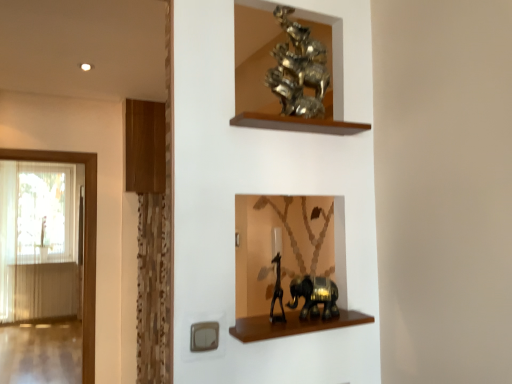
Question: Is wooden at left, the second shelf positioned from the front, wider or thinner than gold metallic sculpture at upper center, placed as the third animal when sorted from bottom to top?

Choices:
 (A) wide
 (B) thin

Answer: (A)

Question: Is point (128, 162) closer or farther from the camera than point (266, 84)?

Choices:
 (A) closer
 (B) farther

Answer: (B)

Question: Which object is the farthest from the translucent glass door at left?

Choices:
 (A) brown wooden shelf at lower center, the first shelf when ordered from bottom to top
 (B) wooden at left, marked as the second shelf in a bottom-to-top arrangement
 (C) shiny black elephant at lower center, the first animal from the bottom
 (D) metallic gold giraffe at lower center, the 2th animal in the top-to-bottom sequence
 (E) gold metallic sculpture at upper center, arranged as the 1th animal when viewed from the top

Answer: (C)

Question: Considering the real-world distances, which object is farthest from the shiny black elephant at lower center, the first animal from the bottom?

Choices:
 (A) brown wooden shelf at lower center, the second shelf in the left-to-right sequence
 (B) wooden at left, placed as the second shelf when sorted from right to left
 (C) gold metallic sculpture at upper center, arranged as the 1th animal when viewed from the top
 (D) translucent glass door at left
 (E) metallic gold giraffe at lower center, which ranks as the 2th animal in bottom-to-top order

Answer: (D)